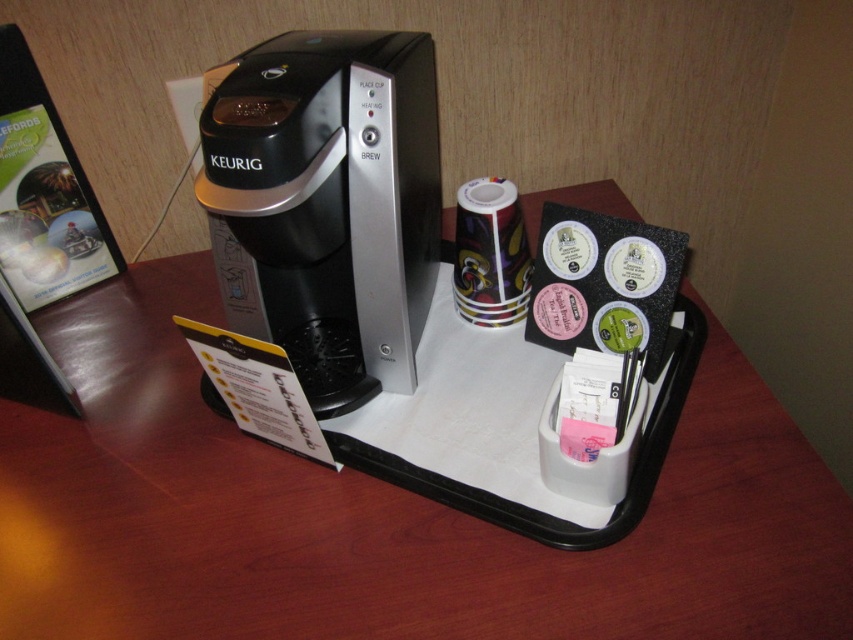
Where is the black plastic tray at center located in the image?

The black plastic tray at center is located at point [379,515] in the image.

You are organizing the items on the desk and need to place a new coffee pod. The black plastic keurig at center requires the pod to be placed directly above it. Is the black plastic tray at center positioned correctly for this purpose?

The black plastic tray at center is below the black plastic keurig at center, so it is not positioned correctly to place the coffee pod directly above the keurig. The tray is located below the keurig, so placing the pod there would not be above the machine.